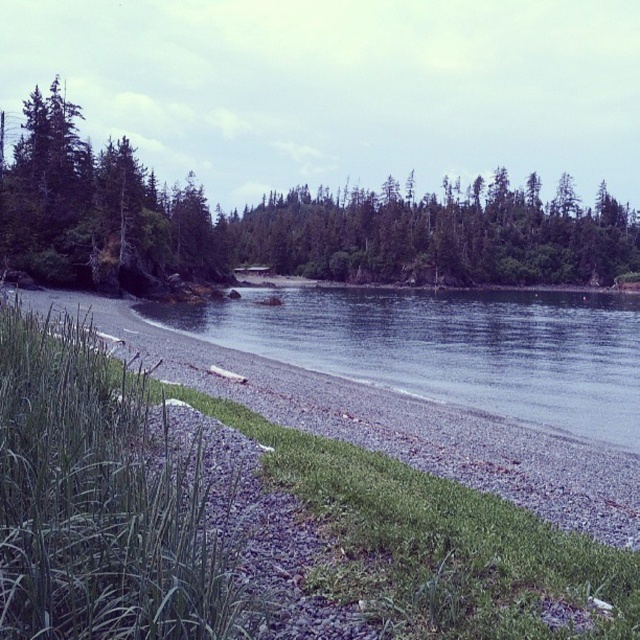
You are standing at the grassy area on the left side of the image and want to take a photo of both the point at coordinates point (x=298, y=211) and the point at coordinates point (x=509, y=298). Which point will appear closer to the camera in your photo?

Point (x=298, y=211) is further to the camera than point (x=509, y=298), so in the photo, point (x=298, y=211) will appear closer to the camera than point (x=509, y=298).